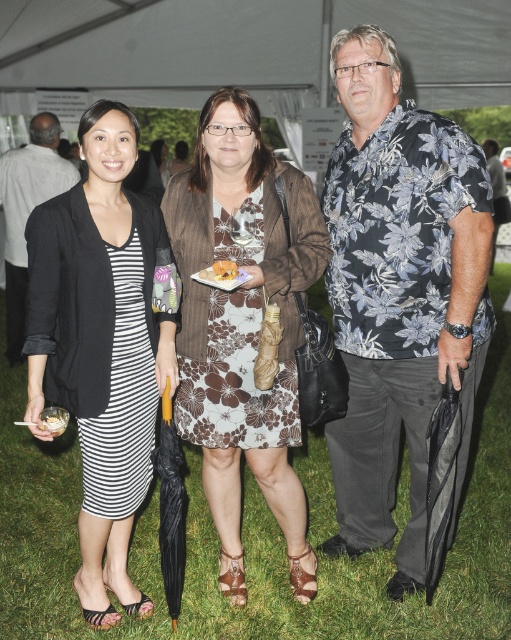
Can you confirm if striped fabric dress at center is taller than brown floral dress at center?

Incorrect, striped fabric dress at center's height is not larger of brown floral dress at center's.

Which is above, striped fabric dress at center or brown floral dress at center?

brown floral dress at center

Does point (108, 220) come closer to viewer compared to point (239, 321)?

Yes, it is.

This screenshot has height=640, width=511. What are the coordinates of `striped fabric dress at center` in the screenshot? It's located at (102, 344).

Does brown floral dress at center appear over black fabric jacket at upper left?

No.

Who is higher up, brown floral dress at center or black fabric jacket at upper left?

Positioned higher is black fabric jacket at upper left.

Is point (218, 436) positioned behind point (43, 125)?

No, it is in front of (43, 125).

Find the location of a particular element. The image size is (511, 640). brown floral dress at center is located at coordinates (243, 324).

Is point (49, 416) farther from viewer compared to point (223, 273)?

That is False.

Between point (59, 420) and point (229, 268), which one is positioned in front?

Point (59, 420) is in front.

Does point (62, 429) lie in front of point (223, 278)?

That is True.

Where is `white creamy dessert at center`? The height and width of the screenshot is (640, 511). white creamy dessert at center is located at coordinates (54, 419).